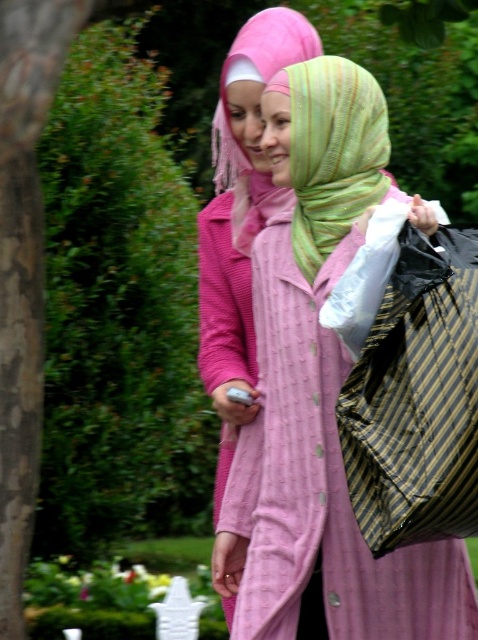
Question: Is matte pink coat at center wider than green striped scarf at center?

Choices:
 (A) no
 (B) yes

Answer: (B)

Question: From the image, what is the correct spatial relationship of matte pink coat at center in relation to green striped scarf at center?

Choices:
 (A) above
 (B) below

Answer: (B)

Question: Does striped fabric bag at right lie behind green striped scarf at center?

Choices:
 (A) no
 (B) yes

Answer: (A)

Question: Estimate the real-world distances between objects in this image. Which object is closer to the striped fabric bag at right?

Choices:
 (A) green striped scarf at center
 (B) matte pink coat at center

Answer: (B)

Question: Which of these objects is positioned farthest from the matte pink coat at center?

Choices:
 (A) green striped scarf at center
 (B) striped fabric bag at right

Answer: (B)

Question: Which of the following is the farthest from the observer?

Choices:
 (A) [x=326, y=252]
 (B) [x=284, y=532]

Answer: (A)